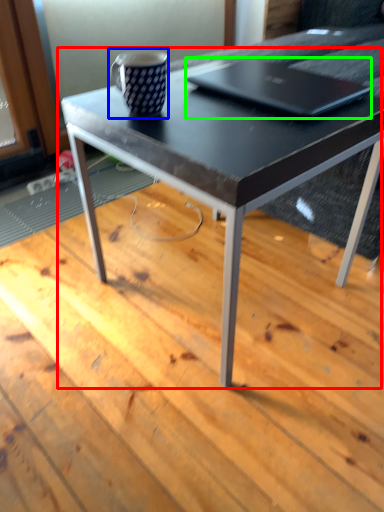
Question: Which object is positioned farthest from coffee table (highlighted by a red box)? Select from coffee cup (highlighted by a blue box) and laptop (highlighted by a green box).

Choices:
 (A) coffee cup
 (B) laptop

Answer: (A)